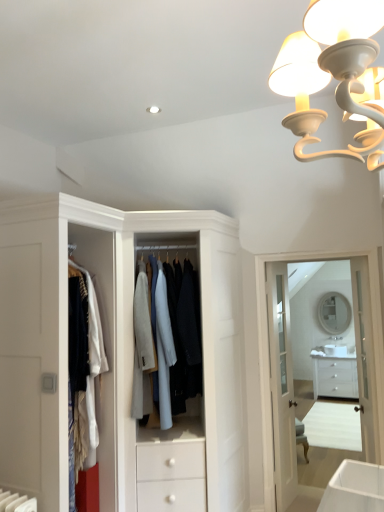
Image resolution: width=384 pixels, height=512 pixels. What are the coordinates of `free space above white glossy medicine cabinet at upper center (from a real-world perspective)` in the screenshot? It's located at (314, 252).